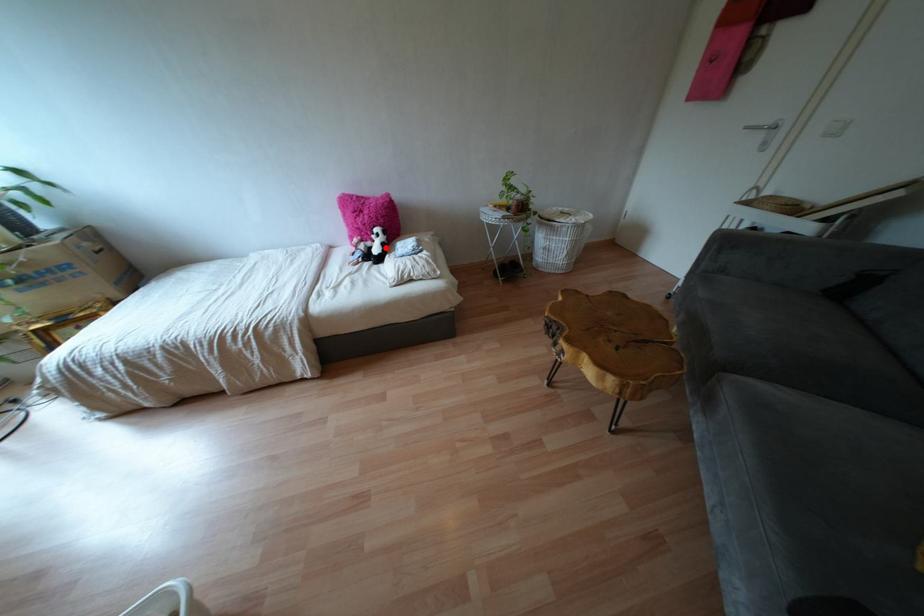
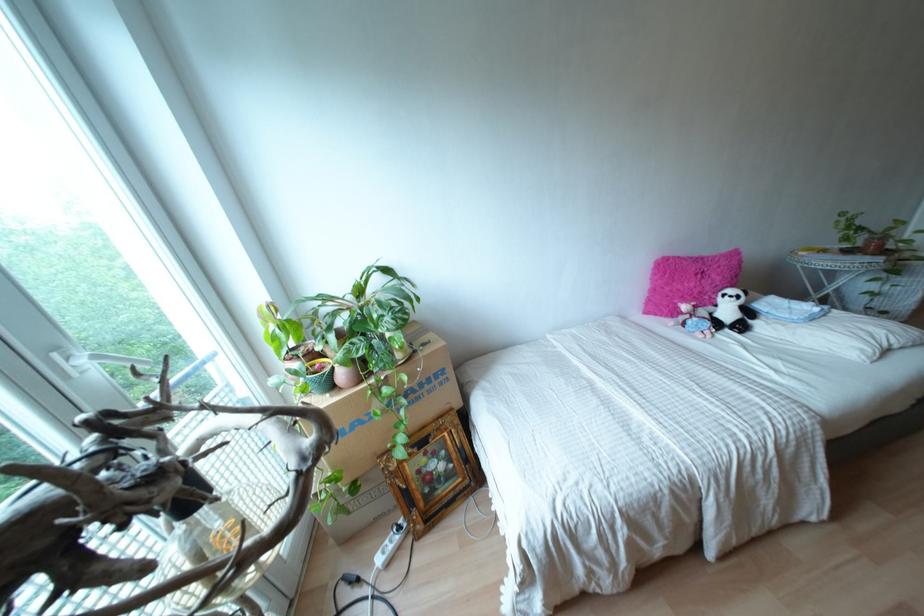
Find the pixel in the second image that matches the highlighted location in the first image.

(747, 312)